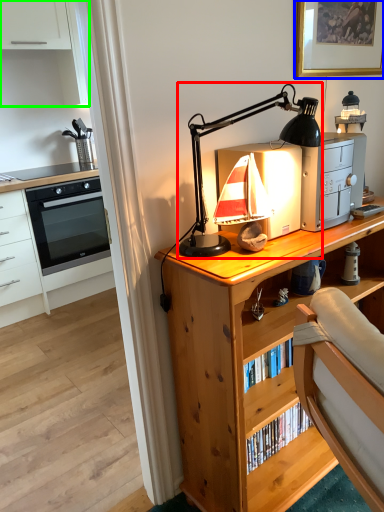
Question: Considering the real-world distances, which object is closest to lamp (highlighted by a red box)? picture frame (highlighted by a blue box) or cabinetry (highlighted by a green box).

Choices:
 (A) picture frame
 (B) cabinetry

Answer: (A)